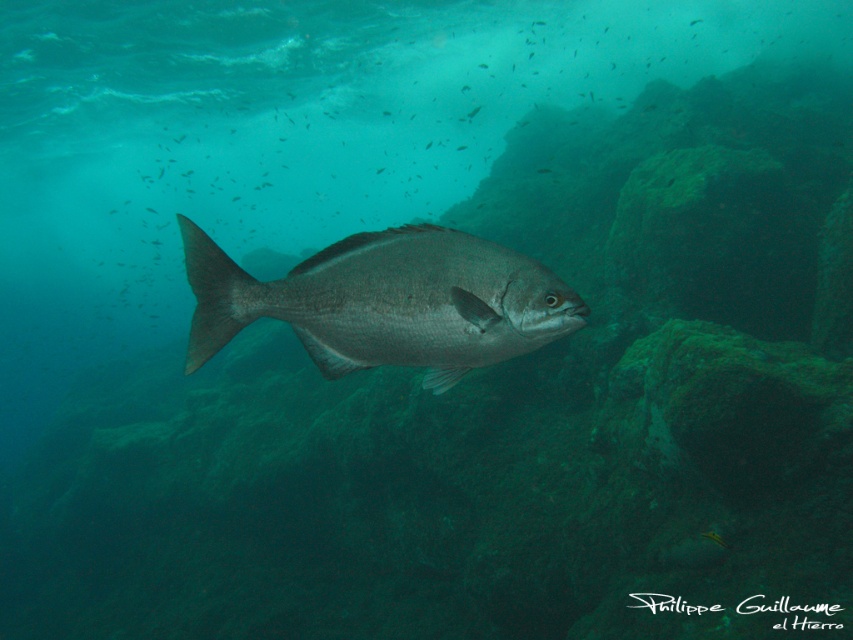
You are a scuba diver observing the underwater scene. You notice the silvery metallic fish at center and the smooth rock at center. Which object is located higher in the water column?

The silvery metallic fish at center is positioned under smooth rock at center, so the smooth rock at center is higher in the water column than the fish.

Looking at this image, you are a scuba diver observing the underwater scene. You notice the silvery metallic fish at center and the smooth rock at center. From your perspective, which object is positioned to the left?

The silvery metallic fish at center is to the left of smooth rock at center, so the silvery metallic fish at center is positioned to the left.

You are a marine biologist observing underwater life through a camera. You notice the silvery metallic fish at center in your viewfinder. If the camera has a maximum focus range of 4 feet, will you be able to focus on the fish?

The silvery metallic fish at center and camera are 4.03 feet apart from each other. Since the distance is slightly over the maximum focus range of 4 feet, the camera cannot focus on the fish.